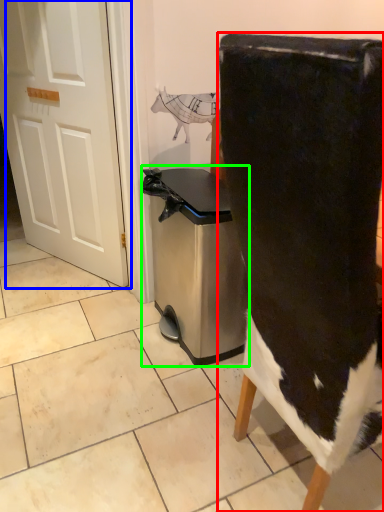
Question: Considering the real-world distances, which object is closest to chair (highlighted by a red box)? door (highlighted by a blue box) or dish washer (highlighted by a green box).

Choices:
 (A) door
 (B) dish washer

Answer: (B)